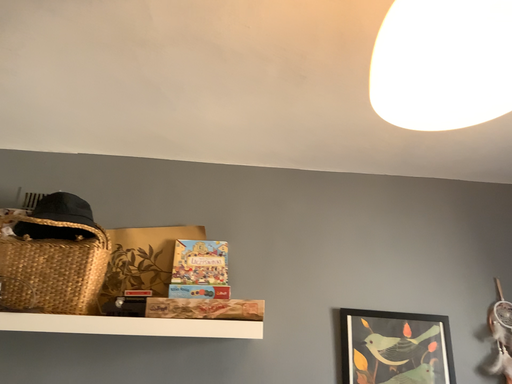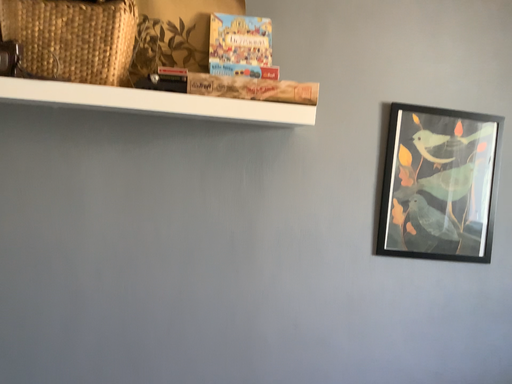
Question: Which way did the camera rotate in the video?

Choices:
 (A) rotated upward
 (B) rotated downward

Answer: (B)